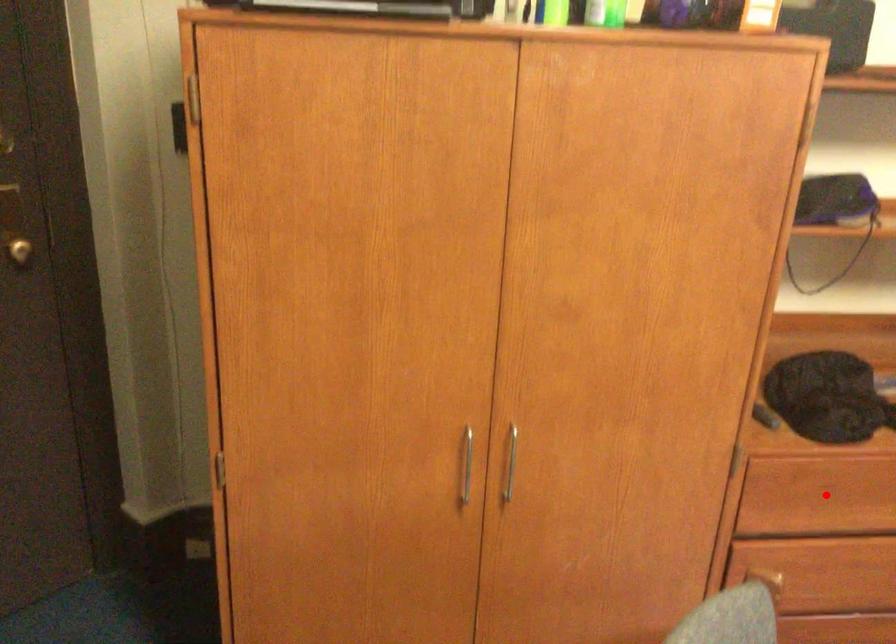
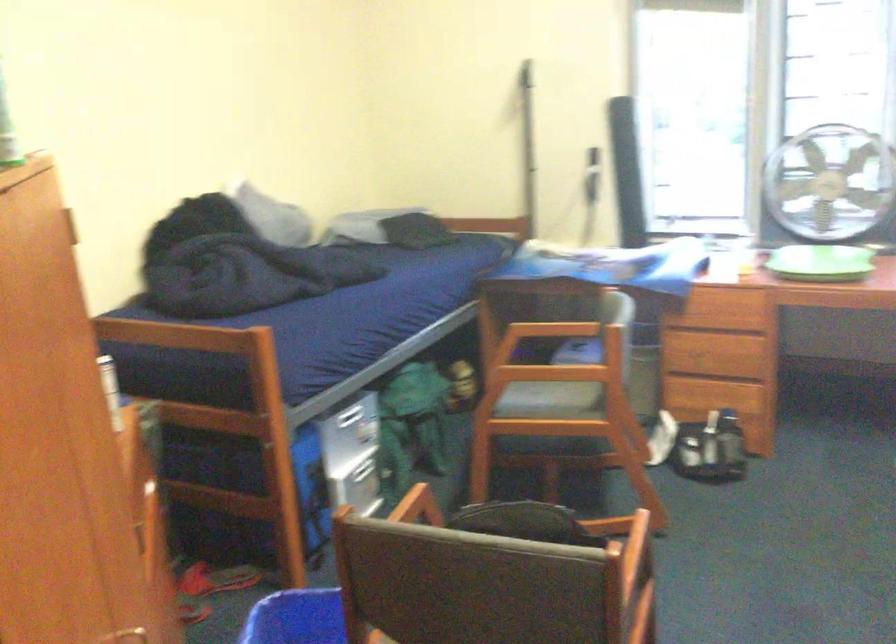
Question: I am providing you with two images of the same scene from different viewpoints. A red point is marked on the first image. At the location where the point appears in image 1, is it still visible in image 2?

Choices:
 (A) Yes
 (B) No

Answer: (B)